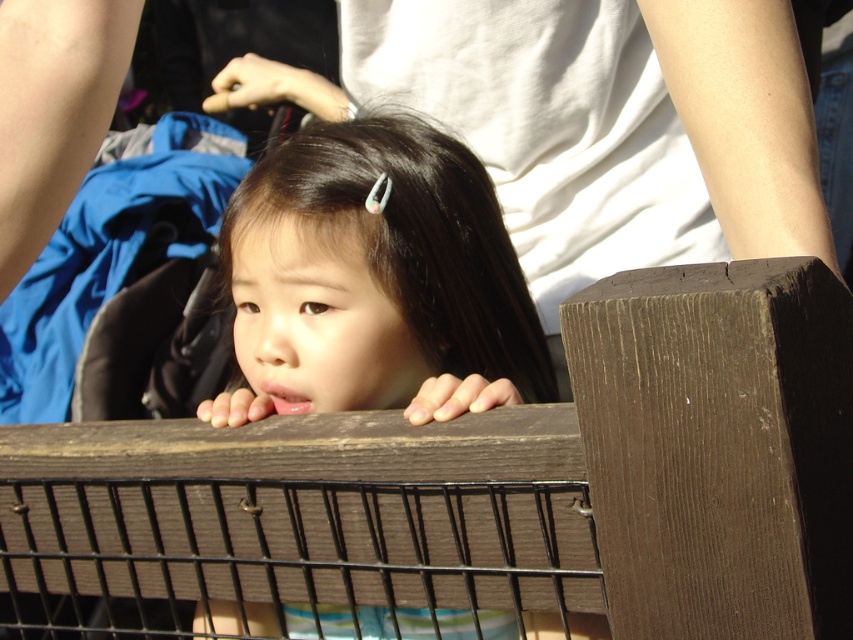
Based on the photo, between brown wooden fence at center and smooth brown hair at center, which one has less height?

brown wooden fence at center

Where is `brown wooden fence at center`? brown wooden fence at center is located at coordinates (503, 480).